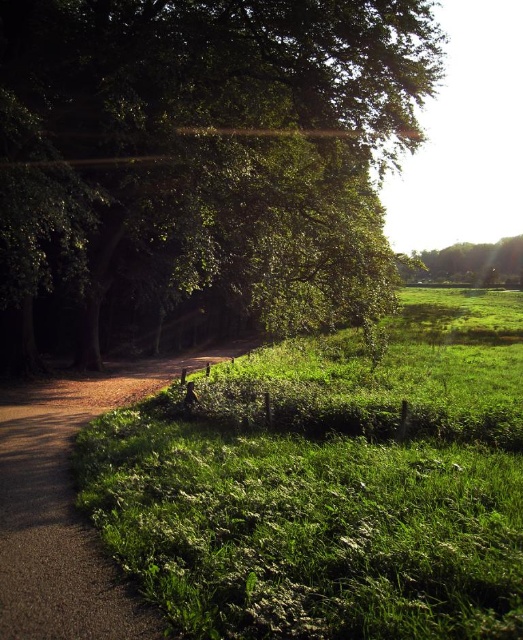
In the scene shown: Can you confirm if green leafy tree at upper left is positioned below dull brown dirt path at lower left?

Incorrect, green leafy tree at upper left is not positioned below dull brown dirt path at lower left.

Who is more distant from viewer, (x=142, y=97) or (x=143, y=387)?

Positioned behind is point (x=143, y=387).

Locate an element on the screen. green leafy tree at upper left is located at coordinates (198, 163).

From the picture: Is dull brown dirt path at lower left to the right of green leafy tree at upper right from the viewer's perspective?

In fact, dull brown dirt path at lower left is to the left of green leafy tree at upper right.

Is dull brown dirt path at lower left in front of green leafy tree at upper right?

That is True.

At what (x,y) coordinates should I click in order to perform the action: click on dull brown dirt path at lower left. Please return your answer as a coordinate pair (x, y). The image size is (523, 640). Looking at the image, I should click on (67, 506).

Does green leafy tree at upper left have a greater width compared to green grassy at center?

No, green leafy tree at upper left is not wider than green grassy at center.

Does point (85, 298) come behind point (514, 557)?

Yes, it is.

At what (x,y) coordinates should I click in order to perform the action: click on green leafy tree at upper left. Please return your answer as a coordinate pair (x, y). This screenshot has height=640, width=523. Looking at the image, I should click on (198, 163).